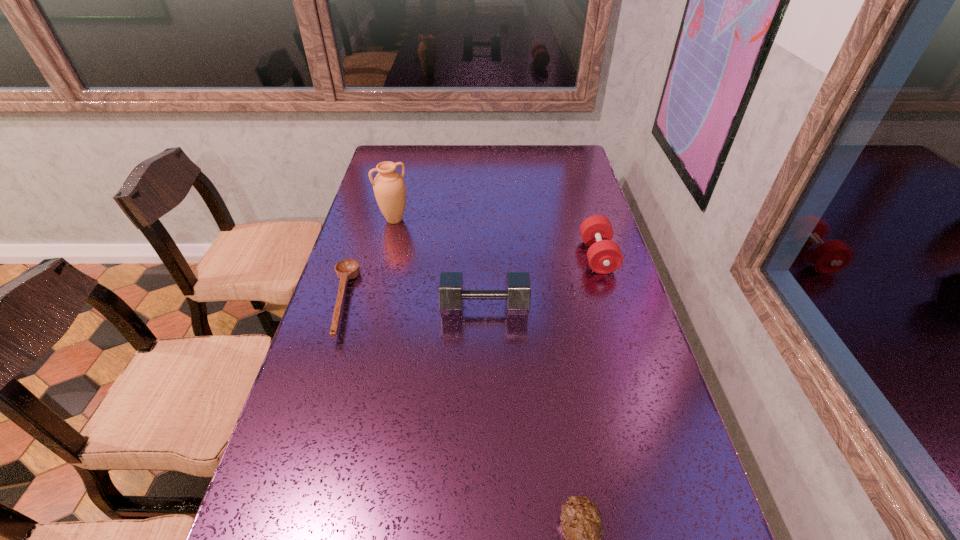
Locate an element on the screen. This screenshot has height=540, width=960. vacant space located 0.070m on the front of the right dumbbell is located at coordinates (609, 293).

You are a GUI agent. You are given a task and a screenshot of the screen. Output one action in this format:
    pyautogui.click(x=<x>, y=<y>)
    Task: Click on the free point located on the right of the wooden spoon
    
    Given the screenshot: What is the action you would take?
    pyautogui.click(x=493, y=301)

The width and height of the screenshot is (960, 540). I want to click on urn at the left edge, so click(389, 187).

The width and height of the screenshot is (960, 540). Identify the location of wooden spoon that is at the left edge. (347, 269).

Where is `object that is at the right edge`? The height and width of the screenshot is (540, 960). object that is at the right edge is located at coordinates (604, 256).

Where is `vacant point at the far edge`? This screenshot has width=960, height=540. vacant point at the far edge is located at coordinates (461, 171).

In the image, there is a desktop. Where is `blank space at the left edge`? blank space at the left edge is located at coordinates (385, 244).

Locate an element on the screen. vacant space at the right edge of the desktop is located at coordinates (588, 196).

Image resolution: width=960 pixels, height=540 pixels. I want to click on vacant space at the far left corner of the desktop, so click(413, 169).

In the image, there is a desktop. Where is `vacant space at the far right corner`? The height and width of the screenshot is (540, 960). vacant space at the far right corner is located at coordinates (581, 169).